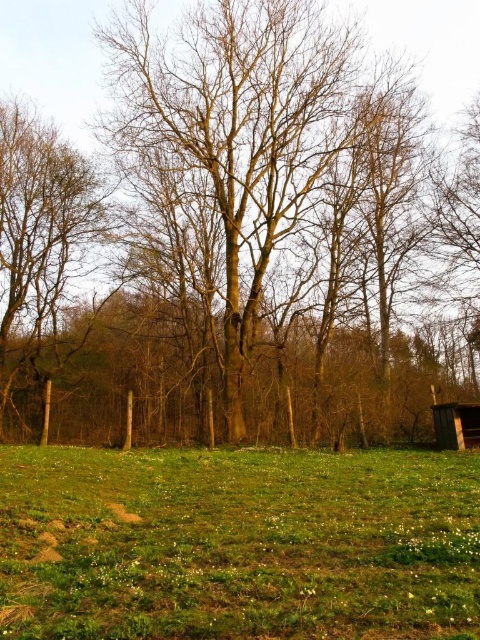
Question: Among these objects, which one is farthest from the camera?

Choices:
 (A) brown rough tree at left
 (B) bare wood tree at center
 (C) brown wooden hut at lower right

Answer: (A)

Question: Can you confirm if green grassy field at center is bigger than brown wooden hut at lower right?

Choices:
 (A) no
 (B) yes

Answer: (B)

Question: Is bare wood tree at center below brown wooden hut at lower right?

Choices:
 (A) yes
 (B) no

Answer: (B)

Question: Which of these objects is positioned closest to the bare wood tree at center?

Choices:
 (A) brown rough tree at left
 (B) brown wooden hut at lower right

Answer: (A)

Question: Among these objects, which one is farthest from the camera?

Choices:
 (A) brown rough tree at left
 (B) bare wood tree at center
 (C) brown wooden hut at lower right

Answer: (A)

Question: Can you confirm if bare wood tree at center is positioned above brown wooden hut at lower right?

Choices:
 (A) yes
 (B) no

Answer: (A)